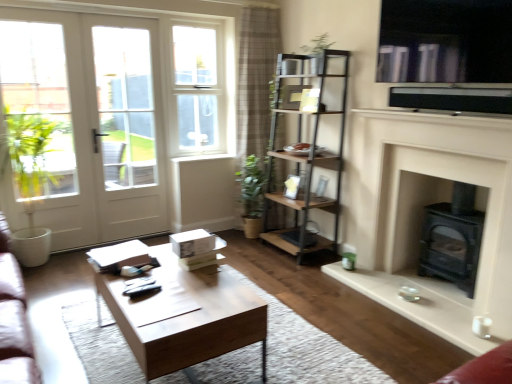
Locate an element on the screen. The image size is (512, 384). blank space situated above white glass door at left (from a real-world perspective) is located at coordinates (40, 11).